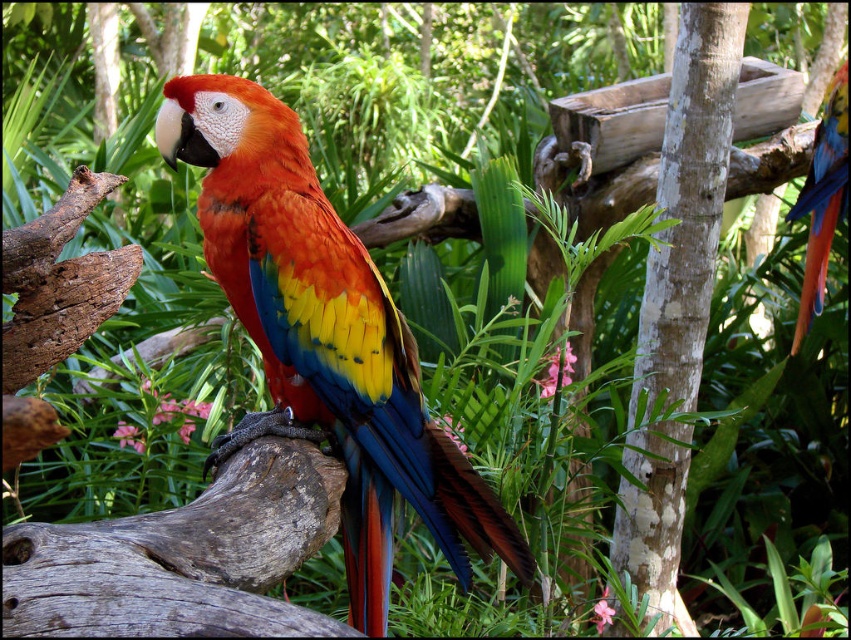
You are a birdwatcher standing in the tropical setting. You notice two points marked in the scene. According to their positions, which point is closer to you, point (407, 364) or point (627, 419)?

Point (407, 364) is in front of point (627, 419), so it is closer to you.